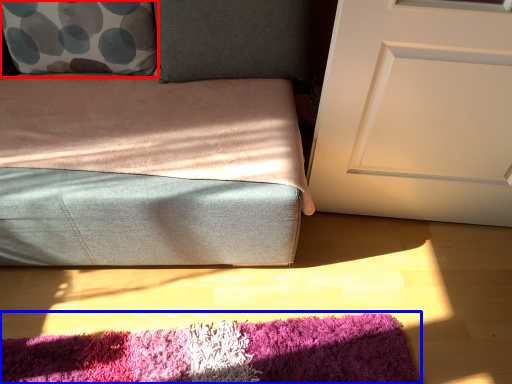
Question: Which of the following is the farthest to the observer, throw pillow (highlighted by a red box) or mat (highlighted by a blue box)?

Choices:
 (A) throw pillow
 (B) mat

Answer: (A)